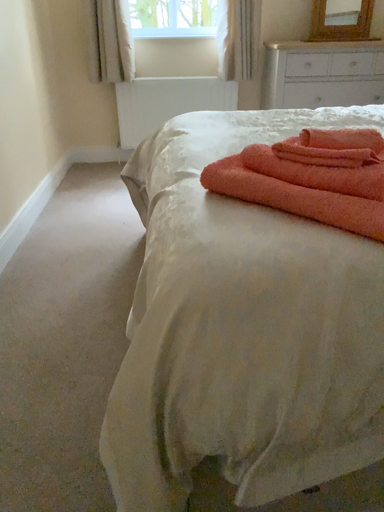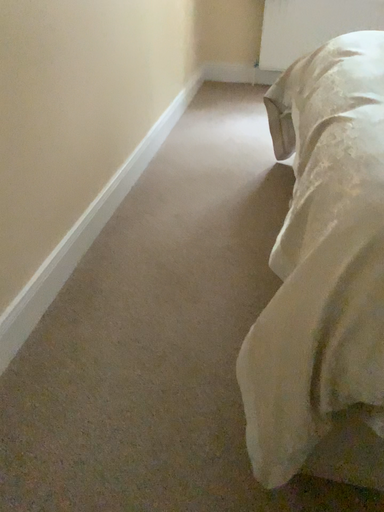
Question: How did the camera likely rotate when shooting the video?

Choices:
 (A) rotated right
 (B) rotated left

Answer: (B)